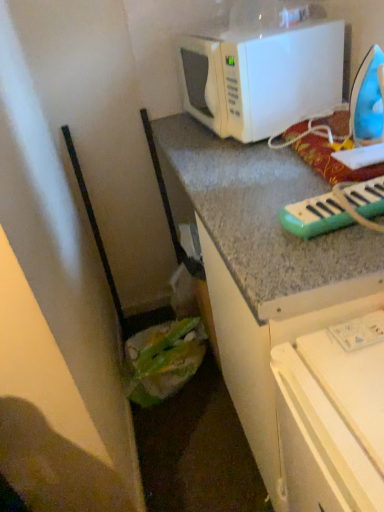
Question: Is green plastic musical keyboard at upper right wider or thinner than white matte microwave at upper center?

Choices:
 (A) thin
 (B) wide

Answer: (B)

Question: Considering their positions, is green plastic musical keyboard at upper right located in front of or behind white matte microwave at upper center?

Choices:
 (A) behind
 (B) front

Answer: (B)

Question: Estimate the real-world distances between objects in this image. Which object is closer to the blue plastic iron at upper right?

Choices:
 (A) white matte microwave at upper center
 (B) green plastic musical keyboard at upper right

Answer: (A)

Question: Which is farther from the green plastic musical keyboard at upper right?

Choices:
 (A) white matte microwave at upper center
 (B) blue plastic iron at upper right

Answer: (A)